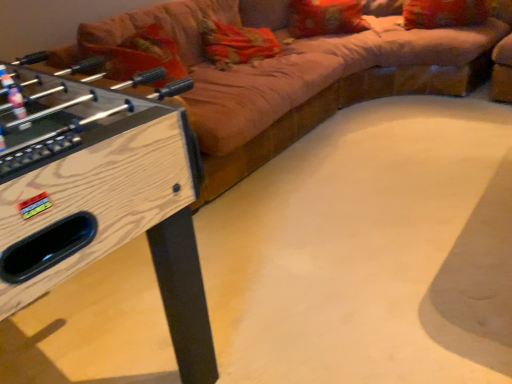
Locate an element on the screen. orange fabric pillow at upper center, the first pillow in the left-to-right sequence is located at coordinates (325, 17).

What do you see at coordinates (444, 13) in the screenshot? I see `velvet-like red pillow at upper right, which ranks as the 2th pillow in left-to-right order` at bounding box center [444, 13].

In order to click on orange fabric pillow at upper center, the first pillow in the left-to-right sequence in this screenshot , I will do `click(325, 17)`.

Does velvet-like red pillow at upper right, which ranks as the 2th pillow in left-to-right order, appear on the right side of velvet beige couch at upper center?

Yes, velvet-like red pillow at upper right, which ranks as the 2th pillow in left-to-right order, is to the right of velvet beige couch at upper center.

Considering the relative sizes of velvet-like red pillow at upper right, arranged as the first pillow when viewed from the right, and velvet beige couch at upper center in the image provided, is velvet-like red pillow at upper right, arranged as the first pillow when viewed from the right, thinner than velvet beige couch at upper center?

Indeed, velvet-like red pillow at upper right, arranged as the first pillow when viewed from the right, has a lesser width compared to velvet beige couch at upper center.

Are velvet-like red pillow at upper right, which ranks as the 2th pillow in left-to-right order, and velvet beige couch at upper center making contact?

No, velvet-like red pillow at upper right, which ranks as the 2th pillow in left-to-right order, is not next to velvet beige couch at upper center.

Measure the distance between velvet-like red pillow at upper right, arranged as the first pillow when viewed from the right, and velvet beige couch at upper center.

velvet-like red pillow at upper right, arranged as the first pillow when viewed from the right, is 74.03 centimeters from velvet beige couch at upper center.

Locate an element on the screen. Image resolution: width=512 pixels, height=384 pixels. the 2nd pillow to the right of the velvet beige couch at upper center, starting your count from the anchor is located at coordinates (444, 13).

Does velvet beige couch at upper center come in front of velvet-like red pillow at upper right, which ranks as the 2th pillow in left-to-right order?

Yes, it is in front of velvet-like red pillow at upper right, which ranks as the 2th pillow in left-to-right order.

Is velvet beige couch at upper center taller or shorter than velvet-like red pillow at upper right, arranged as the first pillow when viewed from the right?

Clearly, velvet beige couch at upper center is taller compared to velvet-like red pillow at upper right, arranged as the first pillow when viewed from the right.

Looking at this image, considering the sizes of velvet beige couch at upper center and wooden foosball table at left in the image, is velvet beige couch at upper center taller or shorter than wooden foosball table at left?

velvet beige couch at upper center is shorter than wooden foosball table at left.

Could you tell me if velvet beige couch at upper center is facing wooden foosball table at left?

No.

Considering the relative sizes of velvet beige couch at upper center and wooden foosball table at left in the image provided, is velvet beige couch at upper center bigger than wooden foosball table at left?

Yes.

Is velvet beige couch at upper center not near wooden foosball table at left?

Indeed, velvet beige couch at upper center is not near wooden foosball table at left.

In terms of width, does velvet beige couch at upper center look wider or thinner when compared to orange fabric pillow at upper center, the first pillow in the left-to-right sequence?

velvet beige couch at upper center is wider than orange fabric pillow at upper center, the first pillow in the left-to-right sequence.

From the picture: Can you confirm if velvet beige couch at upper center is positioned to the right of orange fabric pillow at upper center, marked as the second pillow in a right-to-left arrangement?

In fact, velvet beige couch at upper center is to the left of orange fabric pillow at upper center, marked as the second pillow in a right-to-left arrangement.

How different are the orientations of velvet beige couch at upper center and orange fabric pillow at upper center, marked as the second pillow in a right-to-left arrangement, in degrees?

There is a 32.5-degree angle between the facing directions of velvet beige couch at upper center and orange fabric pillow at upper center, marked as the second pillow in a right-to-left arrangement.

What's the angular difference between velvet-like red pillow at upper right, which ranks as the 2th pillow in left-to-right order, and wooden foosball table at left's facing directions?

velvet-like red pillow at upper right, which ranks as the 2th pillow in left-to-right order, and wooden foosball table at left are facing 162 degrees away from each other.

Is velvet-like red pillow at upper right, arranged as the first pillow when viewed from the right, placed right next to wooden foosball table at left?

No, velvet-like red pillow at upper right, arranged as the first pillow when viewed from the right, is not making contact with wooden foosball table at left.

Considering the sizes of velvet-like red pillow at upper right, arranged as the first pillow when viewed from the right, and wooden foosball table at left in the image, is velvet-like red pillow at upper right, arranged as the first pillow when viewed from the right, wider or thinner than wooden foosball table at left?

Clearly, velvet-like red pillow at upper right, arranged as the first pillow when viewed from the right, has less width compared to wooden foosball table at left.

Does velvet-like red pillow at upper right, arranged as the first pillow when viewed from the right, appear on the left side of wooden foosball table at left?

Incorrect, velvet-like red pillow at upper right, arranged as the first pillow when viewed from the right, is not on the left side of wooden foosball table at left.

How much distance is there between orange fabric pillow at upper center, the first pillow in the left-to-right sequence, and wooden foosball table at left?

orange fabric pillow at upper center, the first pillow in the left-to-right sequence, is 7.80 feet away from wooden foosball table at left.

From a real-world perspective, is orange fabric pillow at upper center, marked as the second pillow in a right-to-left arrangement, physically below wooden foosball table at left?

Incorrect, from a real-world perspective, orange fabric pillow at upper center, marked as the second pillow in a right-to-left arrangement, is higher than wooden foosball table at left.

Considering the relative sizes of orange fabric pillow at upper center, marked as the second pillow in a right-to-left arrangement, and wooden foosball table at left in the image provided, is orange fabric pillow at upper center, marked as the second pillow in a right-to-left arrangement, wider than wooden foosball table at left?

No.

Is point (295, 25) closer or farther from the camera than point (155, 146)?

Point (295, 25) appears to be farther away from the viewer than point (155, 146).

Is velvet-like red pillow at upper right, arranged as the first pillow when viewed from the right, at the back of wooden foosball table at left?

wooden foosball table at left does not have its back to velvet-like red pillow at upper right, arranged as the first pillow when viewed from the right.

How different are the orientations of wooden foosball table at left and velvet-like red pillow at upper right, which ranks as the 2th pillow in left-to-right order, in degrees?

There is a 162-degree angle between the facing directions of wooden foosball table at left and velvet-like red pillow at upper right, which ranks as the 2th pillow in left-to-right order.

In the image, is wooden foosball table at left on the left side or the right side of velvet-like red pillow at upper right, which ranks as the 2th pillow in left-to-right order?

From the image, it's evident that wooden foosball table at left is to the left of velvet-like red pillow at upper right, which ranks as the 2th pillow in left-to-right order.

Considering the sizes of wooden foosball table at left and velvet-like red pillow at upper right, which ranks as the 2th pillow in left-to-right order, in the image, is wooden foosball table at left taller or shorter than velvet-like red pillow at upper right, which ranks as the 2th pillow in left-to-right order,?

In the image, wooden foosball table at left appears to be taller than velvet-like red pillow at upper right, which ranks as the 2th pillow in left-to-right order.

I want to click on studio couch to the left of velvet-like red pillow at upper right, which ranks as the 2th pillow in left-to-right order, so click(293, 79).

Locate an element on the screen. The image size is (512, 384). studio couch that appears below the velvet-like red pillow at upper right, which ranks as the 2th pillow in left-to-right order (from the image's perspective) is located at coordinates (x=293, y=79).

Looking at the image, which one is located closer to velvet-like red pillow at upper right, which ranks as the 2th pillow in left-to-right order, orange fabric pillow at upper center, the first pillow in the left-to-right sequence, or wooden foosball table at left?

orange fabric pillow at upper center, the first pillow in the left-to-right sequence, is closer to velvet-like red pillow at upper right, which ranks as the 2th pillow in left-to-right order.

Estimate the real-world distances between objects in this image. Which object is further from wooden foosball table at left, orange fabric pillow at upper center, the first pillow in the left-to-right sequence, or velvet-like red pillow at upper right, which ranks as the 2th pillow in left-to-right order?

velvet-like red pillow at upper right, which ranks as the 2th pillow in left-to-right order.

Estimate the real-world distances between objects in this image. Which object is further from orange fabric pillow at upper center, marked as the second pillow in a right-to-left arrangement, wooden foosball table at left or velvet beige couch at upper center?

Based on the image, wooden foosball table at left appears to be further to orange fabric pillow at upper center, marked as the second pillow in a right-to-left arrangement.

When comparing their distances from velvet beige couch at upper center, does wooden foosball table at left or velvet-like red pillow at upper right, arranged as the first pillow when viewed from the right, seem closer?

velvet-like red pillow at upper right, arranged as the first pillow when viewed from the right, is closer to velvet beige couch at upper center.

Which object lies nearer to the anchor point orange fabric pillow at upper center, the first pillow in the left-to-right sequence, velvet-like red pillow at upper right, which ranks as the 2th pillow in left-to-right order, or wooden foosball table at left?

velvet-like red pillow at upper right, which ranks as the 2th pillow in left-to-right order.

Which object lies further to the anchor point velvet beige couch at upper center, orange fabric pillow at upper center, the first pillow in the left-to-right sequence, or velvet-like red pillow at upper right, arranged as the first pillow when viewed from the right?

Among the two, velvet-like red pillow at upper right, arranged as the first pillow when viewed from the right, is located further to velvet beige couch at upper center.

Based on their spatial positions, is velvet beige couch at upper center or velvet-like red pillow at upper right, arranged as the first pillow when viewed from the right, further from orange fabric pillow at upper center, the first pillow in the left-to-right sequence?

Based on the image, velvet beige couch at upper center appears to be further to orange fabric pillow at upper center, the first pillow in the left-to-right sequence.

Based on their spatial positions, is velvet-like red pillow at upper right, arranged as the first pillow when viewed from the right, or orange fabric pillow at upper center, marked as the second pillow in a right-to-left arrangement, further from velvet beige couch at upper center?

velvet-like red pillow at upper right, arranged as the first pillow when viewed from the right, is further to velvet beige couch at upper center.

Find the location of a particular element. Image resolution: width=512 pixels, height=384 pixels. pillow located between velvet beige couch at upper center and orange fabric pillow at upper center, the first pillow in the left-to-right sequence, in the depth direction is located at coordinates (444, 13).

Locate an element on the screen. studio couch between wooden foosball table at left and orange fabric pillow at upper center, the first pillow in the left-to-right sequence, along the z-axis is located at coordinates (293, 79).

Locate an element on the screen. The height and width of the screenshot is (384, 512). studio couch between wooden foosball table at left and velvet-like red pillow at upper right, arranged as the first pillow when viewed from the right, along the z-axis is located at coordinates (293, 79).

I want to click on pillow between wooden foosball table at left and orange fabric pillow at upper center, marked as the second pillow in a right-to-left arrangement, along the z-axis, so pos(444,13).